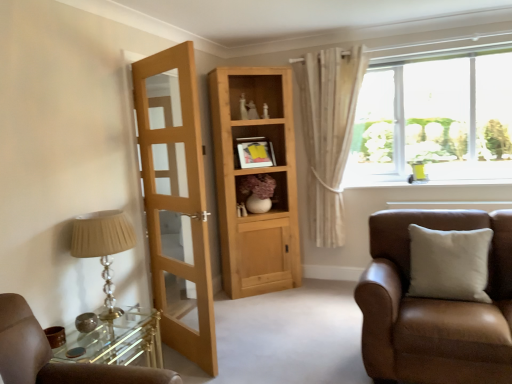
Question: Considering the positions of light brown wooden door at left and brown leather chair at right in the image, is light brown wooden door at left taller or shorter than brown leather chair at right?

Choices:
 (A) short
 (B) tall

Answer: (B)

Question: From the image's perspective, relative to brown leather chair at right, is light brown wooden door at left above or below?

Choices:
 (A) above
 (B) below

Answer: (A)

Question: Which of these objects is positioned farthest from the white textured curtain at upper right?

Choices:
 (A) light brown wooden door at left
 (B) clear glass window at upper right
 (C) brown leather chair at right
 (D) white matte pillow at right
 (E) natural wood cabinet at center

Answer: (A)

Question: Which of these objects is positioned closest to the matte beige lampshade at left?

Choices:
 (A) natural wood cabinet at center
 (B) white matte pillow at right
 (C) white textured curtain at upper right
 (D) white glossy window sill at upper right
 (E) clear glass window at upper right

Answer: (A)